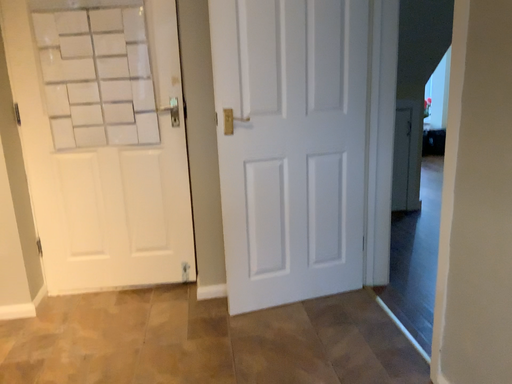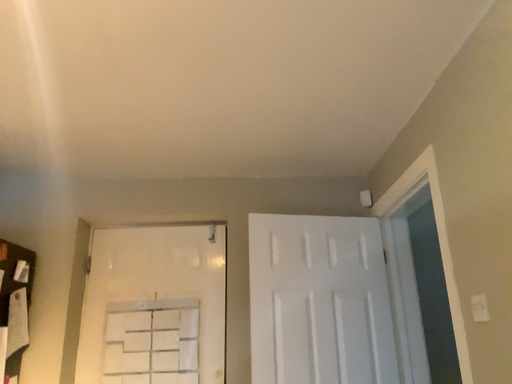
Question: Which way did the camera rotate in the video?

Choices:
 (A) rotated right
 (B) rotated left

Answer: (B)